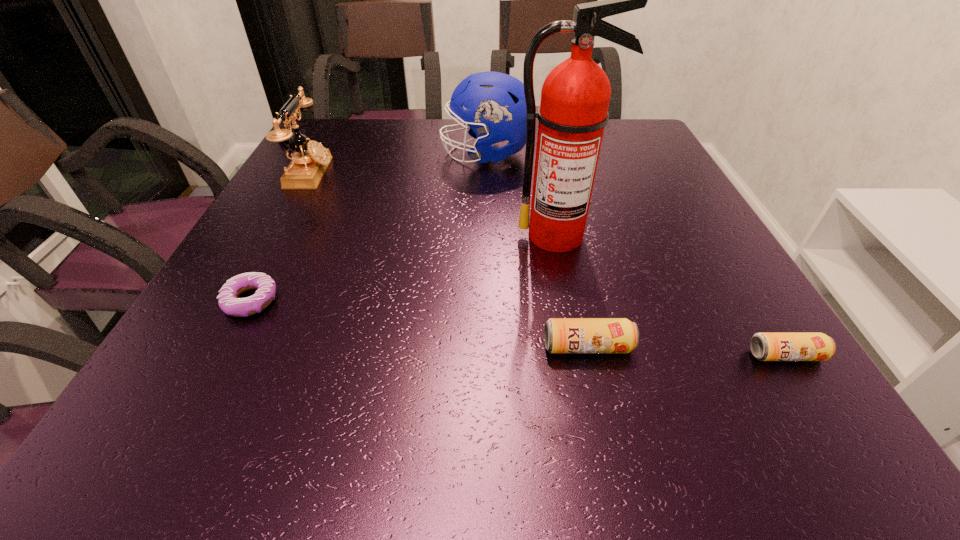
Please point a spot to add another beer can on the left. Please provide its 2D coordinates. Your answer should be formatted as a tuple, i.e. [(x, y)], where the tuple contains the x and y coordinates of a point satisfying the conditions above.

[(396, 339)]